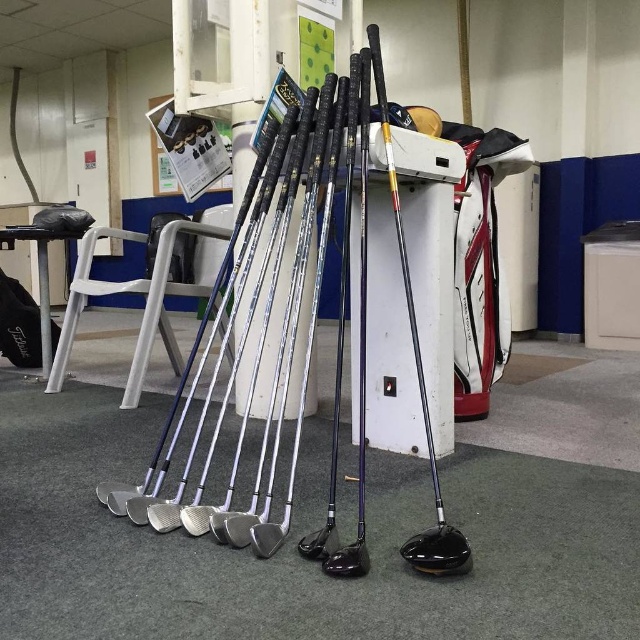
Which of these two, shiny black golf club at center or black rubber golf club at center, stands shorter?

black rubber golf club at center

Locate an element on the screen. The height and width of the screenshot is (640, 640). shiny black golf club at center is located at coordinates (358, 323).

Locate an element on the screen. shiny black golf club at center is located at coordinates (358, 323).

Does shiny black golf club at center appear on the left side of black plastic stool at lower left?

No, shiny black golf club at center is not to the left of black plastic stool at lower left.

Which is behind, point (326, 516) or point (45, 257)?

The point (45, 257) is more distant.

Identify the location of shiny black golf club at center. (358, 323).

Who is lower down, black rubber golf club at center or black plastic stool at lower left?

black rubber golf club at center is below.

Which is above, black rubber golf club at center or black plastic stool at lower left?

Positioned higher is black plastic stool at lower left.

Does point (333, 538) lie in front of point (48, 268)?

That is True.

Where is `black rubber golf club at center`? Image resolution: width=640 pixels, height=640 pixels. black rubber golf club at center is located at coordinates (332, 440).